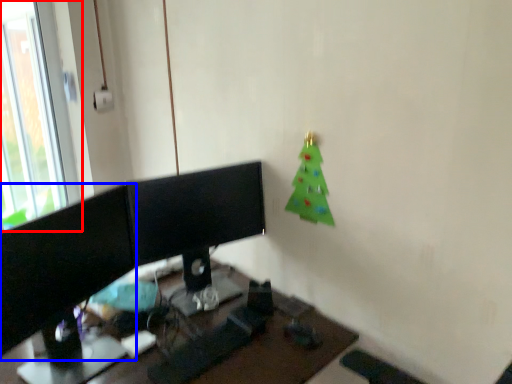
Question: Among these objects, which one is nearest to the camera, window (highlighted by a red box) or computer monitor (highlighted by a blue box)?

Choices:
 (A) window
 (B) computer monitor

Answer: (B)